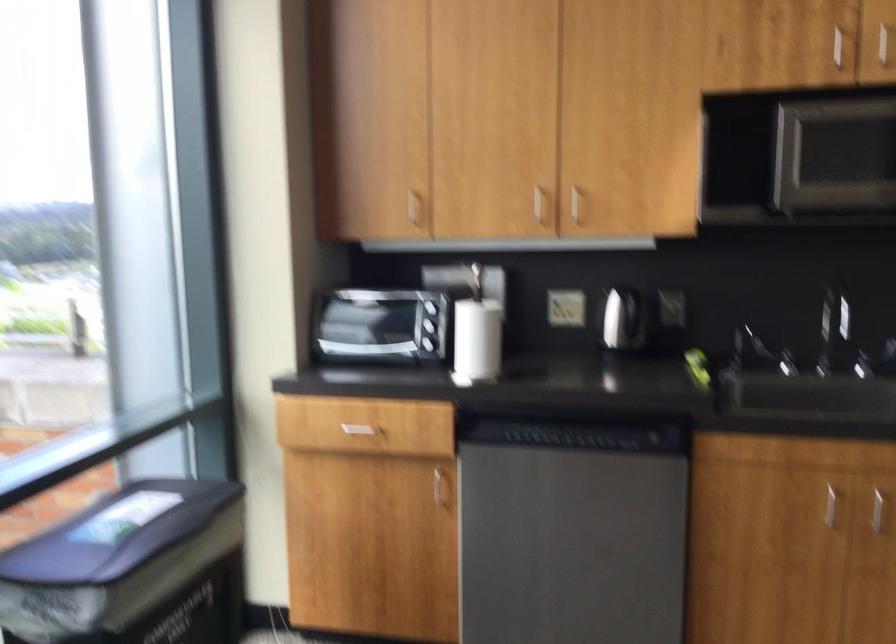
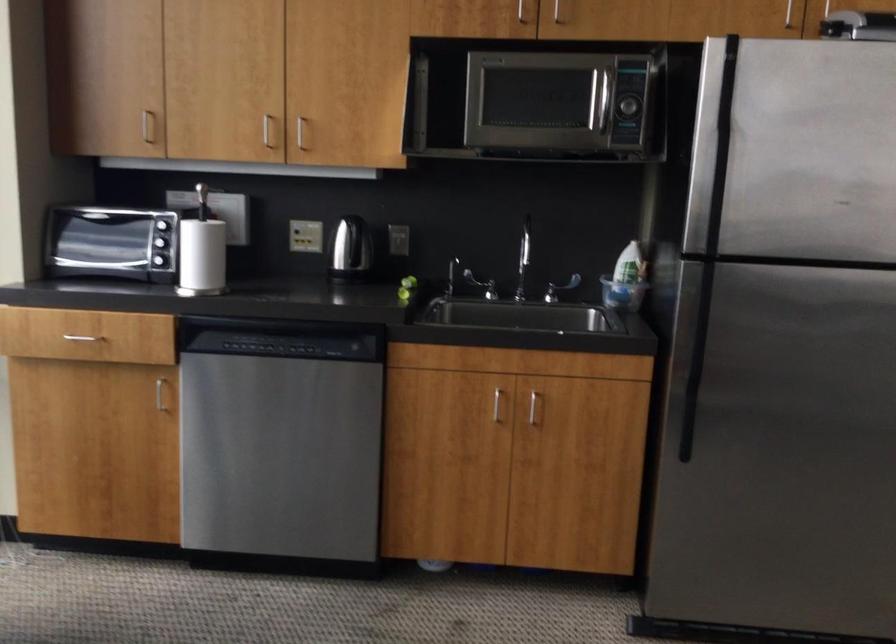
In the second image, find the point that corresponds to (x=782, y=355) in the first image.

(480, 285)